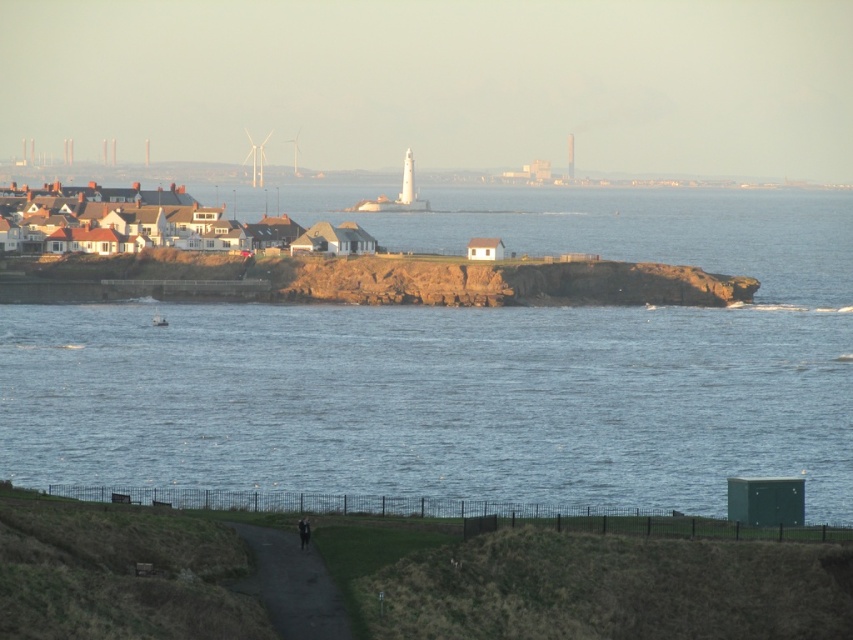
Question: Can you confirm if dirt/gravel path at lower center is thinner than black leather jacket at lower center?

Choices:
 (A) no
 (B) yes

Answer: (A)

Question: Which point is farther to the camera?

Choices:
 (A) white matte houses at left
 (B) dirt/gravel path at lower center
 (C) blue water at center

Answer: (A)

Question: Which of the following is the farthest from the observer?

Choices:
 (A) (312, 237)
 (B) (265, 566)

Answer: (A)

Question: Which object is the closest to the blue water at center?

Choices:
 (A) black leather jacket at lower center
 (B) white matte houses at left

Answer: (B)

Question: Is dirt/gravel path at lower center above black leather jacket at lower center?

Choices:
 (A) yes
 (B) no

Answer: (B)

Question: Can you confirm if white matte houses at left is bigger than black leather jacket at lower center?

Choices:
 (A) no
 (B) yes

Answer: (B)